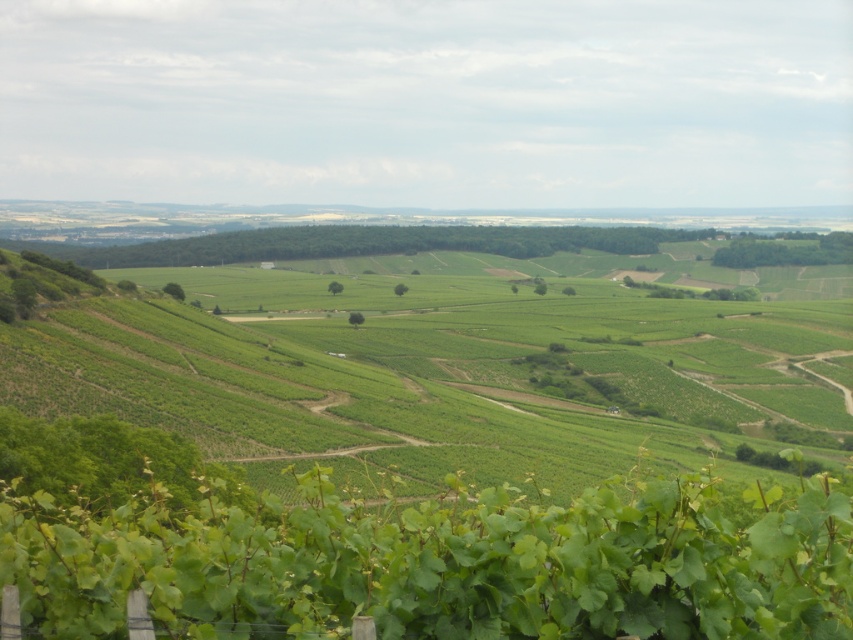
Question: Is green leafy vines at lower center positioned behind green leafy vine at lower center?

Choices:
 (A) no
 (B) yes

Answer: (B)

Question: Is green leafy vines at lower center closer to camera compared to green leafy vine at lower center?

Choices:
 (A) yes
 (B) no

Answer: (B)

Question: Which of the following is the closest to the observer?

Choices:
 (A) green leafy vines at lower center
 (B) green leafy vine at lower center

Answer: (B)

Question: Can you confirm if green leafy vines at lower center is wider than green leafy vine at lower center?

Choices:
 (A) yes
 (B) no

Answer: (A)